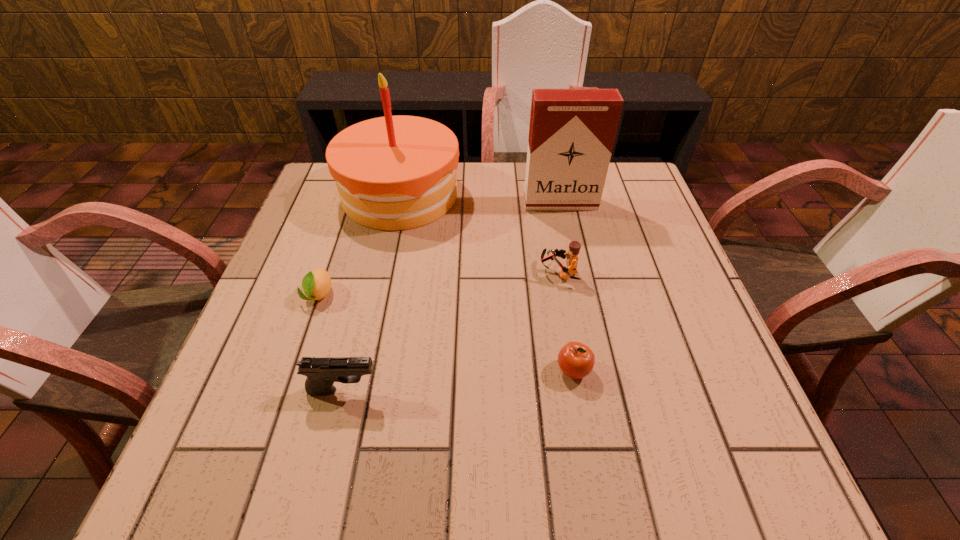
What are the coordinates of `unoccupied position between the shortest object and the birthday cake` in the screenshot? It's located at (359, 245).

Identify the location of free spot between the Lego and the fifth tallest object. The image size is (960, 540). (566, 322).

Locate an element on the screen. free spot between the pistol and the birthday cake is located at coordinates (372, 292).

Locate an element on the screen. The width and height of the screenshot is (960, 540). free space between the fifth tallest object and the cigarette_case is located at coordinates (567, 287).

Identify the location of free space between the lemon and the apple. (445, 332).

What are the coordinates of `vacant area between the lemon and the pistol` in the screenshot? It's located at (331, 342).

This screenshot has height=540, width=960. Identify the location of free space between the pistol and the cigarette_case. (452, 296).

Image resolution: width=960 pixels, height=540 pixels. Find the location of `empty space that is in between the lemon and the birthday cake`. empty space that is in between the lemon and the birthday cake is located at coordinates (359, 245).

The width and height of the screenshot is (960, 540). Identify the location of the third closest object to the pistol. (574, 247).

You are a GUI agent. You are given a task and a screenshot of the screen. Output one action in this format:
    pyautogui.click(x=<x>, y=<y>)
    Task: Click on the third closest object to the shortest object
    This screenshot has width=960, height=540.
    Given the screenshot: What is the action you would take?
    pyautogui.click(x=574, y=247)